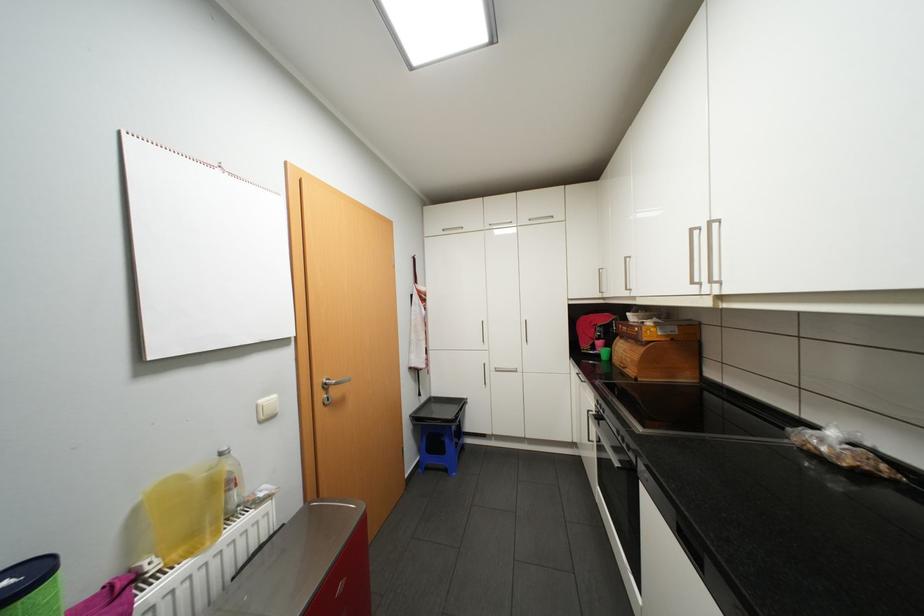
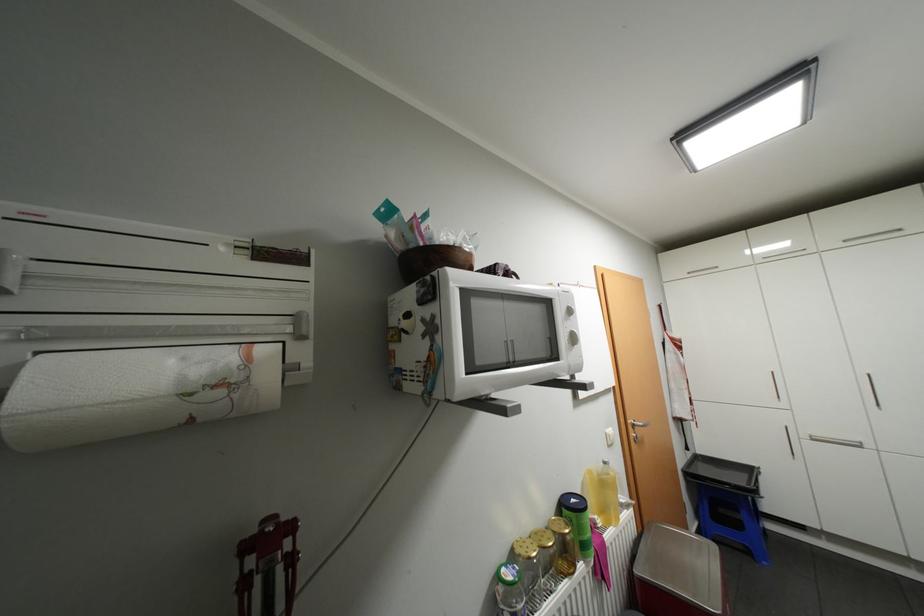
Locate, in the second image, the point that corresponds to the point at 454,469 in the first image.

(756, 552)